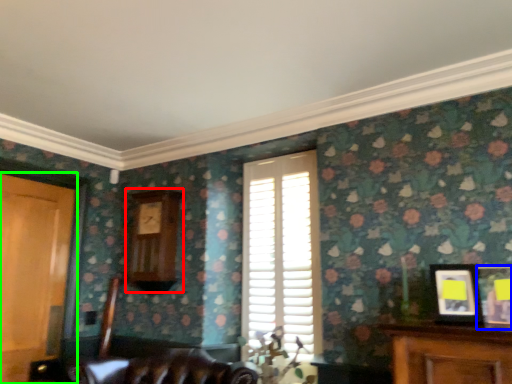
Question: Which object is the closest to the clock (highlighted by a red box)? Choose among these: picture frame (highlighted by a blue box) or door (highlighted by a green box).

Choices:
 (A) picture frame
 (B) door

Answer: (B)